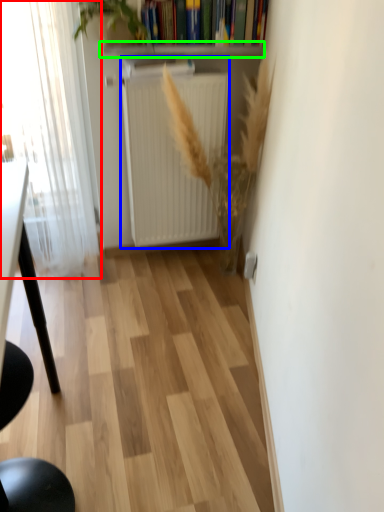
Question: Which object is positioned farthest from window (highlighted by a red box)? Select from radiator (highlighted by a blue box) and window sill (highlighted by a green box).

Choices:
 (A) radiator
 (B) window sill

Answer: (B)